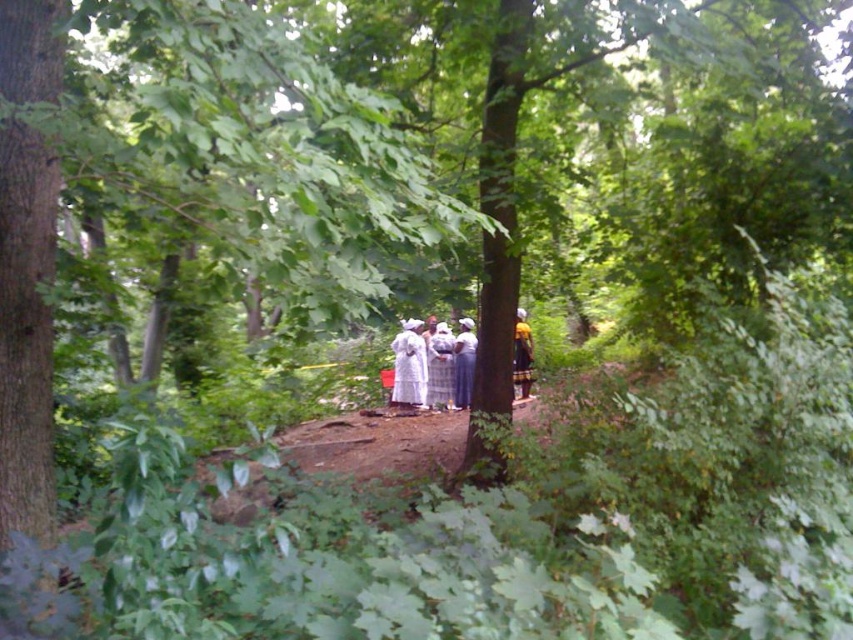
Is point (445, 394) behind point (523, 321)?

No, (445, 394) is in front of (523, 321).

Is white fabric at center in front of yellow fabric dress at center?

That is False.

Measure the distance between white fabric at center and camera.

white fabric at center is 13.37 meters away from camera.

Locate an element on the screen. white fabric at center is located at coordinates (426, 365).